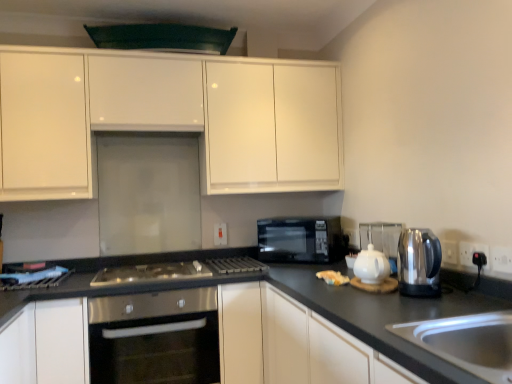
Question: From a real-world perspective, relative to black plastic electric outlet at lower right, the second electric outlet when ordered from front to back, is black plastic electric outlet at right, which is the third electric outlet from left to right, vertically above or below?

Choices:
 (A) above
 (B) below

Answer: (A)

Question: Does point (495, 256) appear closer or farther from the camera than point (467, 258)?

Choices:
 (A) closer
 (B) farther

Answer: (A)

Question: Based on their relative distances, which object is nearer to the black matte countertop at lower right, the second cabinetry when ordered from top to bottom?

Choices:
 (A) black plastic electric outlet at lower right, which ranks as the 2th electric outlet in left-to-right order
 (B) stainless steel sink at lower right
 (C) black glass microwave at center
 (D) stainless steel kettle at right
 (E) stainless steel gas stove at center

Answer: (B)

Question: Considering the real-world distances, which object is closest to the black matte exhaust hood at upper center?

Choices:
 (A) stainless steel kettle at right
 (B) white matte cabinet at lower left, positioned as the third cabinetry in top-to-bottom order
 (C) stainless steel oven at center
 (D) white ceramic teapot at right
 (E) white glossy teapot at center-right

Answer: (D)